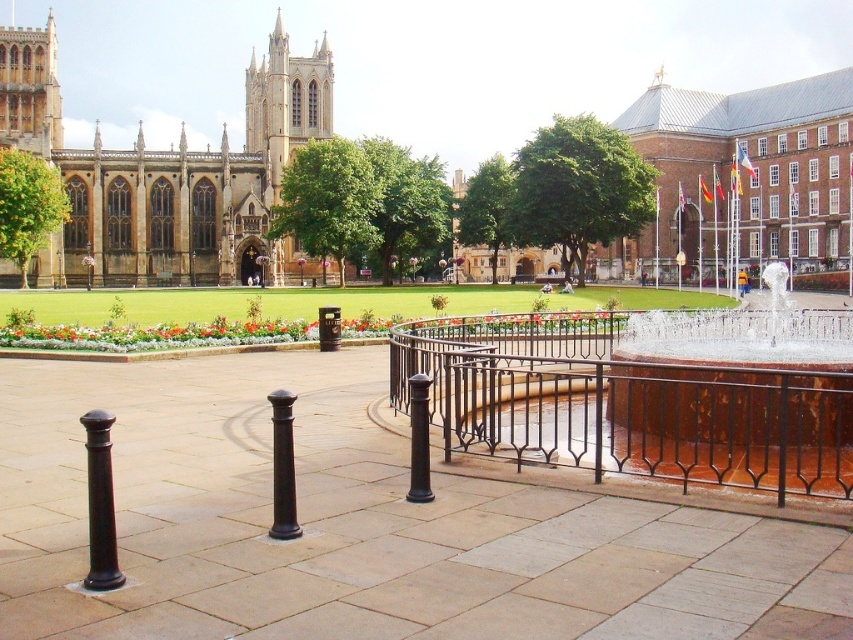
Looking at this image, who is taller, polished dark brown bollard at lower left or black polished post at center?

With more height is polished dark brown bollard at lower left.

Which is more to the right, polished dark brown bollard at lower left or black polished post at center?

black polished post at center is more to the right.

The height and width of the screenshot is (640, 853). Find the location of `polished dark brown bollard at lower left`. polished dark brown bollard at lower left is located at coordinates (100, 502).

Which of these two, black wrought iron fence at center or polished dark brown bollard at lower left, stands taller?

With more height is black wrought iron fence at center.

Can you confirm if black wrought iron fence at center is positioned below polished dark brown bollard at lower left?

No.

Which is behind, point (558, 461) or point (97, 550)?

Positioned behind is point (558, 461).

This screenshot has width=853, height=640. Identify the location of black wrought iron fence at center. (624, 404).

Does black wrought iron fence at center have a greater width compared to black polished post at center?

Indeed, black wrought iron fence at center has a greater width compared to black polished post at center.

Does black wrought iron fence at center have a lesser height compared to black polished post at center?

No, black wrought iron fence at center is not shorter than black polished post at center.

Is point (840, 323) less distant than point (276, 445)?

That is False.

In order to click on black wrought iron fence at center in this screenshot , I will do `click(624, 404)`.